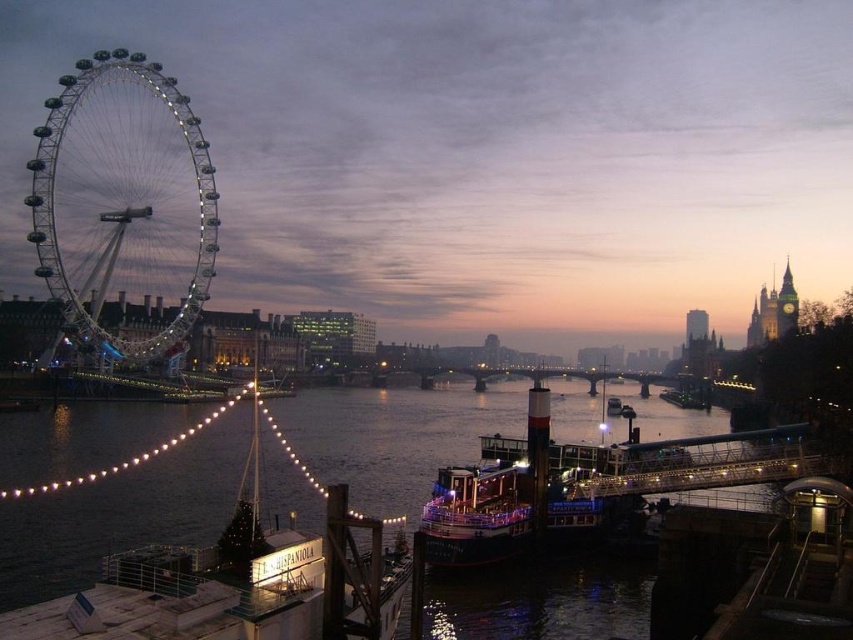
Question: Does dark water at center come behind shiny metallic ferris wheel at left?

Choices:
 (A) yes
 (B) no

Answer: (B)

Question: Among these objects, which one is farthest from the camera?

Choices:
 (A) shiny metallic ferris wheel at left
 (B) shiny red boat at center

Answer: (A)

Question: Which point is farther from the camera taking this photo?

Choices:
 (A) (143, 596)
 (B) (486, 436)

Answer: (B)

Question: Does dark water at center come in front of shiny metallic ferris wheel at left?

Choices:
 (A) yes
 (B) no

Answer: (A)

Question: Is dark water at center bigger than shiny red boat at center?

Choices:
 (A) yes
 (B) no

Answer: (A)

Question: Based on their relative distances, which object is farther from the shiny metallic ferris wheel at left?

Choices:
 (A) shiny red boat at center
 (B) dark water at center

Answer: (A)